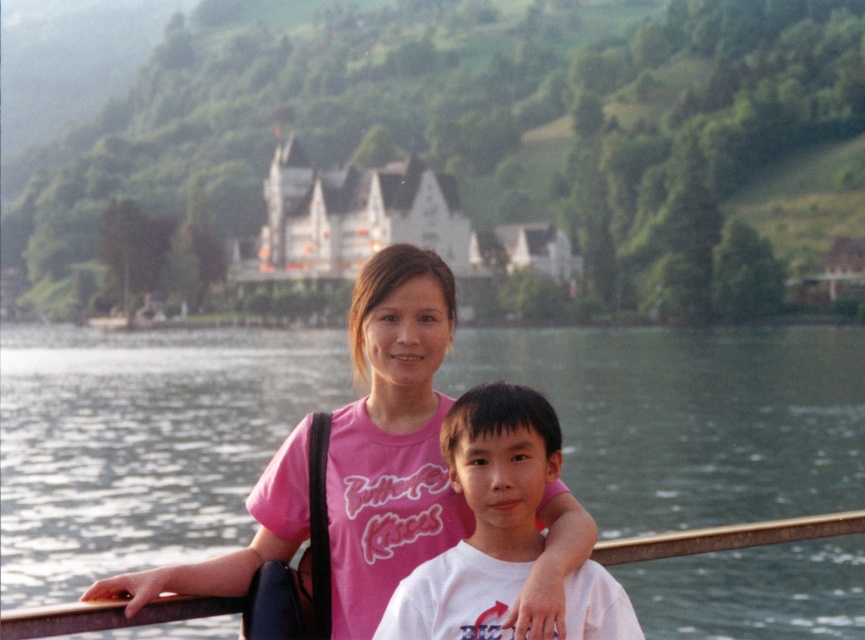
You are standing at the point marked as point [391,436] and want to find the pink fabric shirt at center. In which direction should you look to see it?

The pink fabric shirt at center is located at point [391,436], so you are already at the same location as the pink fabric shirt at center. Look around your current position to find it.

You are a photographer trying to capture a photo of both the pink fabric shirt at center and the white cotton shirt at center. Since you want both shirts to appear the same size in the photo, what should you do?

The pink fabric shirt at center is bigger than the white cotton shirt at center. To make them appear the same size in the photo, move closer to the smaller white cotton shirt at center and farther from the larger pink fabric shirt at center.

You are a photographer trying to capture a clear shot of both the pink fabric shirt at center and the white cotton shirt at center. Which of the two shirts should you focus on first to ensure both are in focus?

The pink fabric shirt at center is in front of the white cotton shirt at center. To ensure both are in focus, you should focus on the pink fabric shirt at center first since it is closer to the camera.